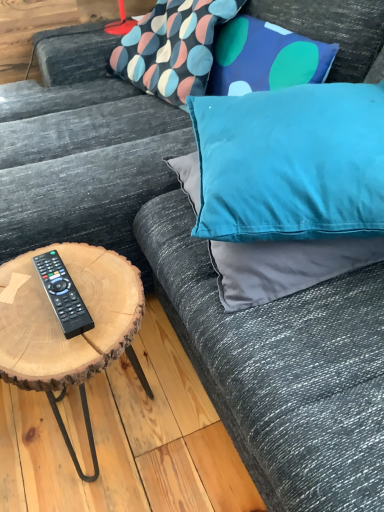
The width and height of the screenshot is (384, 512). What do you see at coordinates (284, 267) in the screenshot?
I see `teal fabric pillow at upper right, which is counted as the first pillow, starting from the bottom` at bounding box center [284, 267].

Image resolution: width=384 pixels, height=512 pixels. Find the location of `teal satin pillow at upper right, which is the second pillow in bottom-to-top order`. teal satin pillow at upper right, which is the second pillow in bottom-to-top order is located at coordinates (291, 163).

The image size is (384, 512). Describe the element at coordinates (173, 48) in the screenshot. I see `textured fabric pillow at upper center, which ranks as the first pillow in top-to-bottom order` at that location.

Identify the location of velvet blue pillow at upper right. (282, 369).

Where is `black plastic remote at lower left`? The image size is (384, 512). black plastic remote at lower left is located at coordinates (63, 294).

The width and height of the screenshot is (384, 512). Identify the location of teal fabric pillow at upper right, which is counted as the first pillow, starting from the bottom. (284, 267).

From the image's perspective, is textured fabric pillow at upper center, arranged as the third pillow when ordered from the bottom, below velvet blue pillow at upper right?

No, from the image's perspective, textured fabric pillow at upper center, arranged as the third pillow when ordered from the bottom, is not below velvet blue pillow at upper right.

From the picture: Considering the relative sizes of textured fabric pillow at upper center, arranged as the third pillow when ordered from the bottom, and velvet blue pillow at upper right in the image provided, is textured fabric pillow at upper center, arranged as the third pillow when ordered from the bottom, taller than velvet blue pillow at upper right?

No.

In terms of size, does textured fabric pillow at upper center, arranged as the third pillow when ordered from the bottom, appear bigger or smaller than velvet blue pillow at upper right?

textured fabric pillow at upper center, arranged as the third pillow when ordered from the bottom, is smaller than velvet blue pillow at upper right.

Considering the positions of objects textured fabric pillow at upper center, which ranks as the first pillow in top-to-bottom order, and velvet blue pillow at upper right in the image provided, who is behind, textured fabric pillow at upper center, which ranks as the first pillow in top-to-bottom order, or velvet blue pillow at upper right?

textured fabric pillow at upper center, which ranks as the first pillow in top-to-bottom order, is behind.

Considering the positions of point (55, 415) and point (315, 249), is point (55, 415) closer or farther from the camera than point (315, 249)?

Point (55, 415) is farther from the camera than point (315, 249).

Is natural wood coffee table at left oriented towards teal fabric pillow at upper right, the third pillow positioned from the top?

No, natural wood coffee table at left is not facing towards teal fabric pillow at upper right, the third pillow positioned from the top.

Can we say natural wood coffee table at left lies outside teal fabric pillow at upper right, which is counted as the first pillow, starting from the bottom?

Indeed, natural wood coffee table at left is completely outside teal fabric pillow at upper right, which is counted as the first pillow, starting from the bottom.

Is natural wood coffee table at left wider than teal fabric pillow at upper right, the third pillow positioned from the top?

In fact, natural wood coffee table at left might be narrower than teal fabric pillow at upper right, the third pillow positioned from the top.

Which object is wider, natural wood coffee table at left or black plastic remote at lower left?

With larger width is natural wood coffee table at left.

Is natural wood coffee table at left placed right next to black plastic remote at lower left?

Yes, natural wood coffee table at left is next to black plastic remote at lower left.

Is natural wood coffee table at left closer to camera compared to black plastic remote at lower left?

Yes.

Looking at this image, is natural wood coffee table at left facing towards black plastic remote at lower left?

No, natural wood coffee table at left does not turn towards black plastic remote at lower left.

Measure the distance from teal fabric pillow at upper right, the third pillow positioned from the top, to black plastic remote at lower left.

teal fabric pillow at upper right, the third pillow positioned from the top, is 13.66 inches from black plastic remote at lower left.

Does teal fabric pillow at upper right, the third pillow positioned from the top, turn towards black plastic remote at lower left?

No, teal fabric pillow at upper right, the third pillow positioned from the top, does not turn towards black plastic remote at lower left.

In the scene shown: From a real-world perspective, between teal fabric pillow at upper right, which is counted as the first pillow, starting from the bottom, and black plastic remote at lower left, who is vertically higher?

black plastic remote at lower left is physically above.

From a real-world perspective, is textured fabric pillow at upper center, which ranks as the first pillow in top-to-bottom order, positioned under natural wood coffee table at left based on gravity?

No, from a real-world perspective, textured fabric pillow at upper center, which ranks as the first pillow in top-to-bottom order, is not below natural wood coffee table at left.

What's the angular difference between textured fabric pillow at upper center, which ranks as the first pillow in top-to-bottom order, and natural wood coffee table at left's facing directions?

textured fabric pillow at upper center, which ranks as the first pillow in top-to-bottom order, and natural wood coffee table at left are facing 82.5 degrees away from each other.

Consider the image. Are textured fabric pillow at upper center, which ranks as the first pillow in top-to-bottom order, and natural wood coffee table at left far apart?

Actually, textured fabric pillow at upper center, which ranks as the first pillow in top-to-bottom order, and natural wood coffee table at left are a little close together.

Considering the positions of objects textured fabric pillow at upper center, arranged as the third pillow when ordered from the bottom, and natural wood coffee table at left in the image provided, who is behind, textured fabric pillow at upper center, arranged as the third pillow when ordered from the bottom, or natural wood coffee table at left?

textured fabric pillow at upper center, arranged as the third pillow when ordered from the bottom, is behind.

In the scene shown: Is black plastic remote at lower left oriented towards natural wood coffee table at left?

Yes, black plastic remote at lower left is oriented towards natural wood coffee table at left.

From the image's perspective, between black plastic remote at lower left and natural wood coffee table at left, which one is located above?

black plastic remote at lower left appears higher in the image.

From a real-world perspective, who is located lower, black plastic remote at lower left or natural wood coffee table at left?

natural wood coffee table at left, from a real-world perspective.

In terms of size, does black plastic remote at lower left appear bigger or smaller than natural wood coffee table at left?

In the image, black plastic remote at lower left appears to be smaller than natural wood coffee table at left.

Is the position of textured fabric pillow at upper center, which ranks as the first pillow in top-to-bottom order, less distant than that of teal satin pillow at upper right, which appears as the second pillow when viewed from the top?

No, textured fabric pillow at upper center, which ranks as the first pillow in top-to-bottom order, is further to the viewer.

Considering the sizes of objects textured fabric pillow at upper center, which ranks as the first pillow in top-to-bottom order, and teal satin pillow at upper right, which appears as the second pillow when viewed from the top, in the image provided, who is smaller, textured fabric pillow at upper center, which ranks as the first pillow in top-to-bottom order, or teal satin pillow at upper right, which appears as the second pillow when viewed from the top,?

teal satin pillow at upper right, which appears as the second pillow when viewed from the top.

Is textured fabric pillow at upper center, arranged as the third pillow when ordered from the bottom, facing towards teal satin pillow at upper right, which appears as the second pillow when viewed from the top?

No, textured fabric pillow at upper center, arranged as the third pillow when ordered from the bottom, is not turned towards teal satin pillow at upper right, which appears as the second pillow when viewed from the top.

Which of these two, textured fabric pillow at upper center, which ranks as the first pillow in top-to-bottom order, or teal satin pillow at upper right, which appears as the second pillow when viewed from the top, is thinner?

textured fabric pillow at upper center, which ranks as the first pillow in top-to-bottom order.

In the image, there is a textured fabric pillow at upper center, arranged as the third pillow when ordered from the bottom. Find the location of `couch below it (from the image's perspective)`. couch below it (from the image's perspective) is located at coordinates (282, 369).

In the image, there is a teal fabric pillow at upper right, which is counted as the first pillow, starting from the bottom. Where is `coffee table below it (from a real-world perspective)`? Image resolution: width=384 pixels, height=512 pixels. coffee table below it (from a real-world perspective) is located at coordinates coord(68,322).

Based on their spatial positions, is black plastic remote at lower left or textured fabric pillow at upper center, arranged as the third pillow when ordered from the bottom, further from teal satin pillow at upper right, which is the second pillow in bottom-to-top order?

The object further to teal satin pillow at upper right, which is the second pillow in bottom-to-top order, is textured fabric pillow at upper center, arranged as the third pillow when ordered from the bottom.

Considering their positions, is textured fabric pillow at upper center, arranged as the third pillow when ordered from the bottom, positioned further to black plastic remote at lower left than velvet blue pillow at upper right?

textured fabric pillow at upper center, arranged as the third pillow when ordered from the bottom, is further to black plastic remote at lower left.

Looking at this image, based on their spatial positions, is teal satin pillow at upper right, which is the second pillow in bottom-to-top order, or teal fabric pillow at upper right, which is counted as the first pillow, starting from the bottom, closer to velvet blue pillow at upper right?

Based on the image, teal fabric pillow at upper right, which is counted as the first pillow, starting from the bottom, appears to be nearer to velvet blue pillow at upper right.

Which object lies further to the anchor point natural wood coffee table at left, teal satin pillow at upper right, which appears as the second pillow when viewed from the top, or textured fabric pillow at upper center, which ranks as the first pillow in top-to-bottom order?

The object further to natural wood coffee table at left is textured fabric pillow at upper center, which ranks as the first pillow in top-to-bottom order.

Looking at the image, which one is located further to teal satin pillow at upper right, which appears as the second pillow when viewed from the top, velvet blue pillow at upper right or black plastic remote at lower left?

black plastic remote at lower left is positioned further to the anchor teal satin pillow at upper right, which appears as the second pillow when viewed from the top.

When comparing their distances from textured fabric pillow at upper center, arranged as the third pillow when ordered from the bottom, does teal satin pillow at upper right, which appears as the second pillow when viewed from the top, or natural wood coffee table at left seem further?

natural wood coffee table at left is further to textured fabric pillow at upper center, arranged as the third pillow when ordered from the bottom.

From the image, which object appears to be farther from teal satin pillow at upper right, which is the second pillow in bottom-to-top order, natural wood coffee table at left or textured fabric pillow at upper center, arranged as the third pillow when ordered from the bottom?

textured fabric pillow at upper center, arranged as the third pillow when ordered from the bottom, is positioned further to the anchor teal satin pillow at upper right, which is the second pillow in bottom-to-top order.

Based on their spatial positions, is teal satin pillow at upper right, which appears as the second pillow when viewed from the top, or velvet blue pillow at upper right further from natural wood coffee table at left?

teal satin pillow at upper right, which appears as the second pillow when viewed from the top, is positioned further to the anchor natural wood coffee table at left.

The width and height of the screenshot is (384, 512). Find the location of `couch between textured fabric pillow at upper center, which ranks as the first pillow in top-to-bottom order, and natural wood coffee table at left, in the vertical direction`. couch between textured fabric pillow at upper center, which ranks as the first pillow in top-to-bottom order, and natural wood coffee table at left, in the vertical direction is located at coordinates (282, 369).

In order to click on remote control between natural wood coffee table at left and teal satin pillow at upper right, which is the second pillow in bottom-to-top order, from left to right in this screenshot , I will do `click(63, 294)`.

I want to click on remote control between textured fabric pillow at upper center, arranged as the third pillow when ordered from the bottom, and natural wood coffee table at left, in the vertical direction, so click(x=63, y=294).

I want to click on remote control between natural wood coffee table at left and teal fabric pillow at upper right, the third pillow positioned from the top, in the horizontal direction, so click(x=63, y=294).